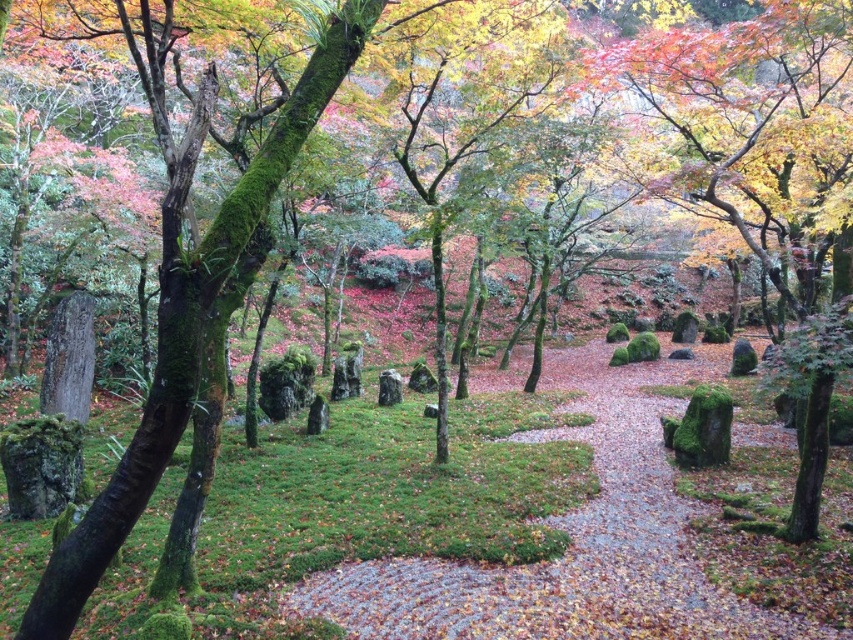
Is the position of autumn leaves at center more distant than that of green mossy tree at left?

Yes, it is behind green mossy tree at left.

Is autumn leaves at center bigger than green mossy tree at left?

Correct, autumn leaves at center is larger in size than green mossy tree at left.

At what (x,y) coordinates should I click in order to perform the action: click on autumn leaves at center. Please return your answer as a coordinate pair (x, y). Looking at the image, I should click on (767, 170).

The height and width of the screenshot is (640, 853). I want to click on autumn leaves at center, so click(767, 170).